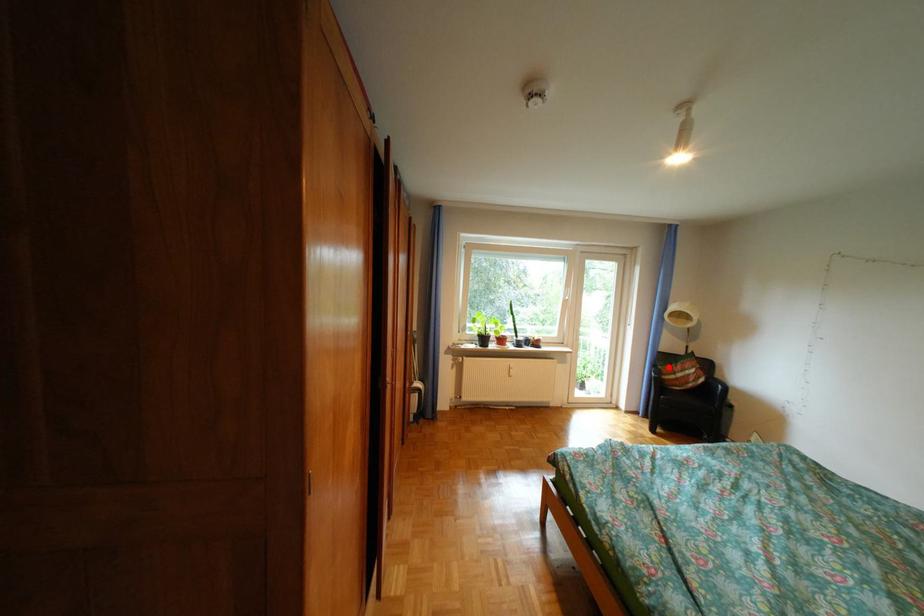
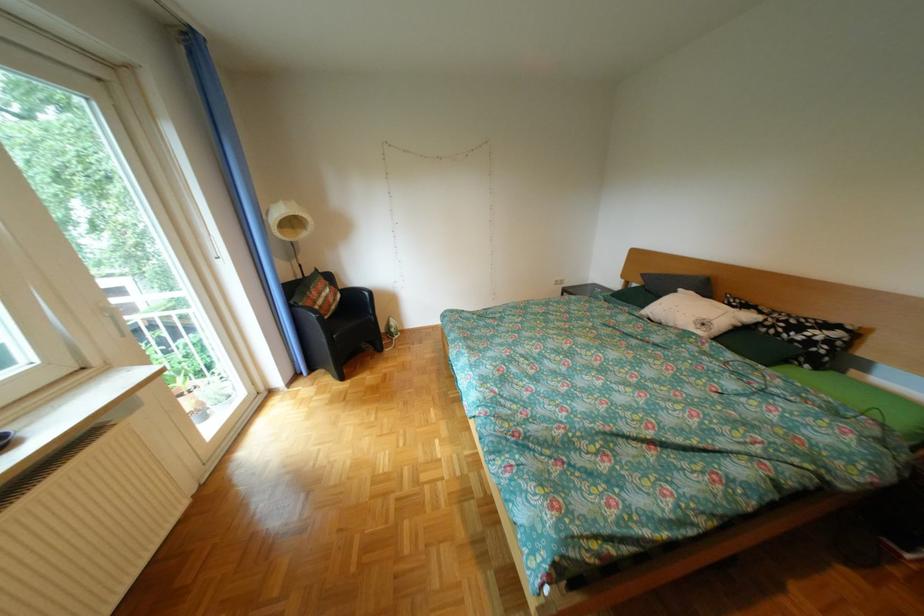
Where in the second image is the point corresponding to the highlighted location from the first image?

(306, 307)